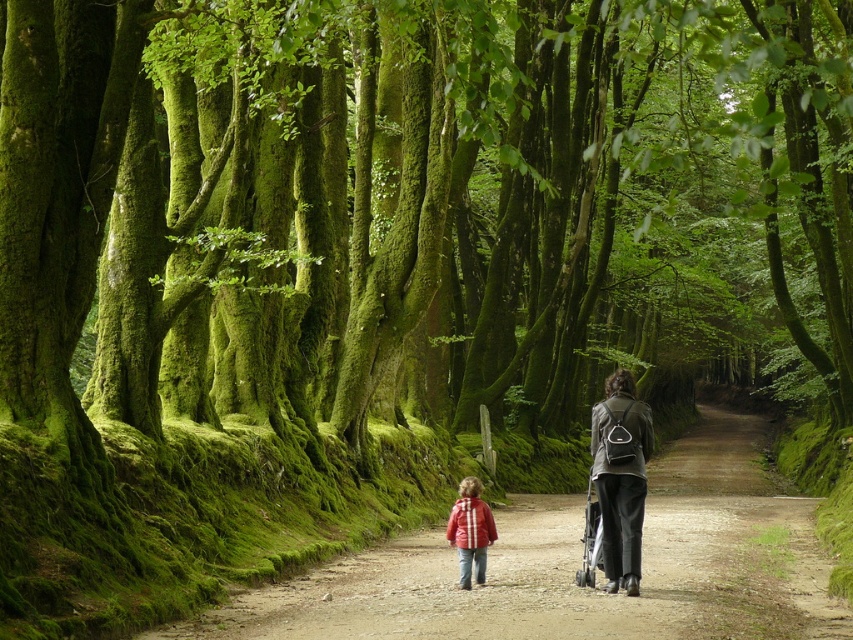
Question: Is the position of matte black backpack at center less distant than that of black plastic baby carriage at center?

Choices:
 (A) no
 (B) yes

Answer: (B)

Question: Can you confirm if dirt path at center is positioned to the left of red plaid jacket at center?

Choices:
 (A) yes
 (B) no

Answer: (B)

Question: Among these points, which one is nearest to the camera?

Choices:
 (A) (473, 486)
 (B) (705, 545)
 (C) (589, 556)

Answer: (C)

Question: Which is nearer to the dirt path at center?

Choices:
 (A) matte black backpack at center
 (B) black plastic baby carriage at center
 (C) red plaid jacket at center

Answer: (B)

Question: Does dirt path at center come behind red plaid jacket at center?

Choices:
 (A) no
 (B) yes

Answer: (A)

Question: Which object is positioned closest to the dirt path at center?

Choices:
 (A) black plastic baby carriage at center
 (B) red plaid jacket at center
 (C) matte black backpack at center

Answer: (A)